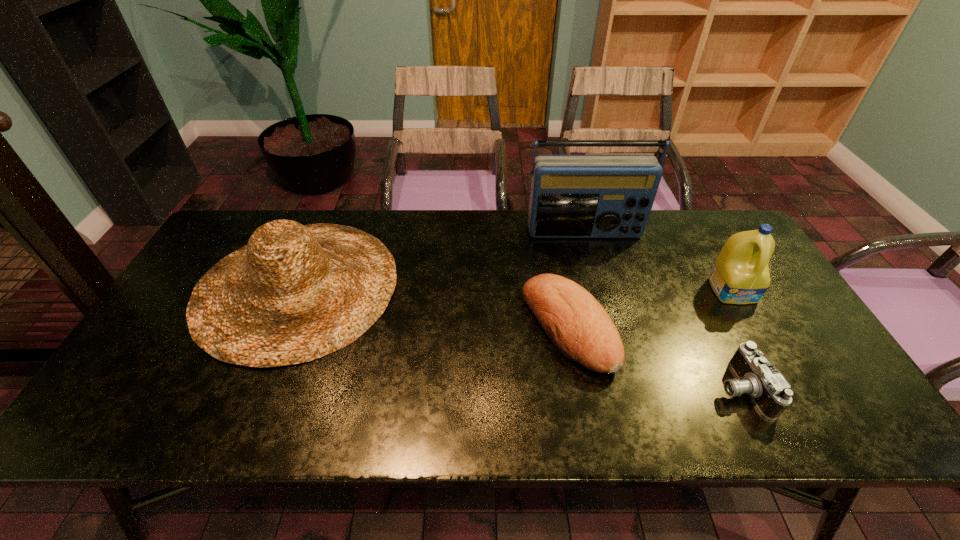
The height and width of the screenshot is (540, 960). Find the location of `vacant point at the near edge`. vacant point at the near edge is located at coordinates (318, 431).

In the image, there is a desktop. At what (x,y) coordinates should I click in order to perform the action: click on free space at the left edge. Please return your answer as a coordinate pair (x, y). Looking at the image, I should click on (190, 293).

In the image, there is a desktop. Identify the location of vacant space at the right edge. (769, 305).

In the image, there is a desktop. Where is `vacant space at the far left corner`? vacant space at the far left corner is located at coordinates (229, 249).

This screenshot has height=540, width=960. Identify the location of vacant space at the near right corner of the desktop. (829, 436).

Identify the location of free space between the tallest object and the camera. The height and width of the screenshot is (540, 960). [662, 310].

I want to click on empty space that is in between the bread and the sunhat, so click(433, 307).

I want to click on unoccupied position between the radio receiver and the camera, so click(662, 310).

You are a GUI agent. You are given a task and a screenshot of the screen. Output one action in this format:
    pyautogui.click(x=<x>, y=<y>)
    Task: Click on the free space between the camera and the detergent
    This screenshot has height=540, width=960.
    Given the screenshot: What is the action you would take?
    pyautogui.click(x=737, y=340)

Find the location of `blank region between the sunhat and the camera`. blank region between the sunhat and the camera is located at coordinates (519, 338).